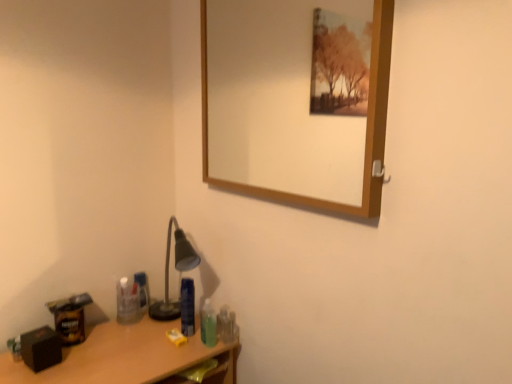
Find the location of a particular element. This screenshot has width=512, height=384. free space to the back side of blue plastic bottle at lower center, the 3th toiletry positioned from the front is located at coordinates (186, 317).